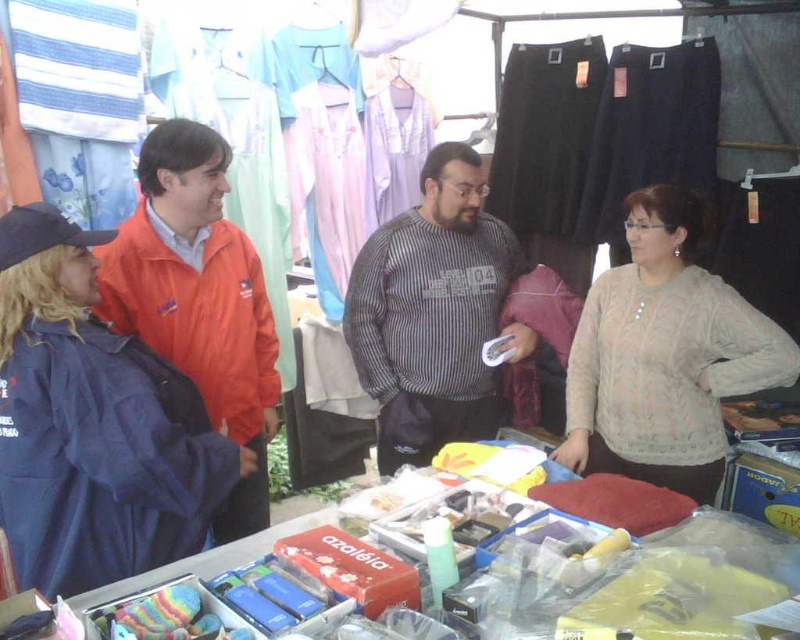
You are a customer at the market and want to find the light beige knitted sweater at center. Based on the coordinates provided, where would you look relative to the table?

The light beige knitted sweater at center is located at coordinates point (664, 356), which is near the center of the table.

You are a customer at the market and want to buy a jacket that fits your petite frame. Which jacket between the matte blue jacket at left and the orange fabric jacket at left is more suitable for your size?

The matte blue jacket at left has a smaller size compared to the orange fabric jacket at left, so it is more suitable for your petite frame.